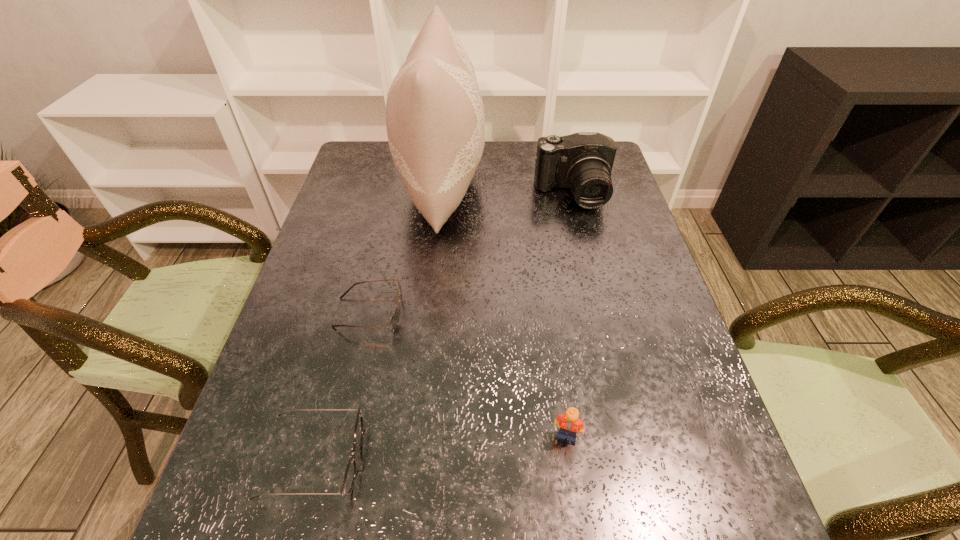
At what (x,y) coordinates should I click in order to perform the action: click on cushion at the far edge. Please return your answer as a coordinate pair (x, y). Image resolution: width=960 pixels, height=540 pixels. Looking at the image, I should click on (435, 121).

What are the coordinates of `camera that is positioned at the far edge` in the screenshot? It's located at (583, 161).

Locate an element on the screen. The image size is (960, 540). sunglasses at the left edge is located at coordinates (394, 320).

Find the location of `spectacles present at the left edge`. spectacles present at the left edge is located at coordinates (350, 475).

I want to click on object that is at the right edge, so click(583, 161).

The height and width of the screenshot is (540, 960). I want to click on object that is at the far right corner, so click(x=583, y=161).

The height and width of the screenshot is (540, 960). In the image, there is a desktop. Find the location of `vacant space at the far edge`. vacant space at the far edge is located at coordinates (489, 143).

Identify the location of vacant space at the near edge. (633, 527).

Identify the location of blank area at the right edge. (689, 476).

The height and width of the screenshot is (540, 960). I want to click on blank space at the far left corner of the desktop, so click(x=377, y=154).